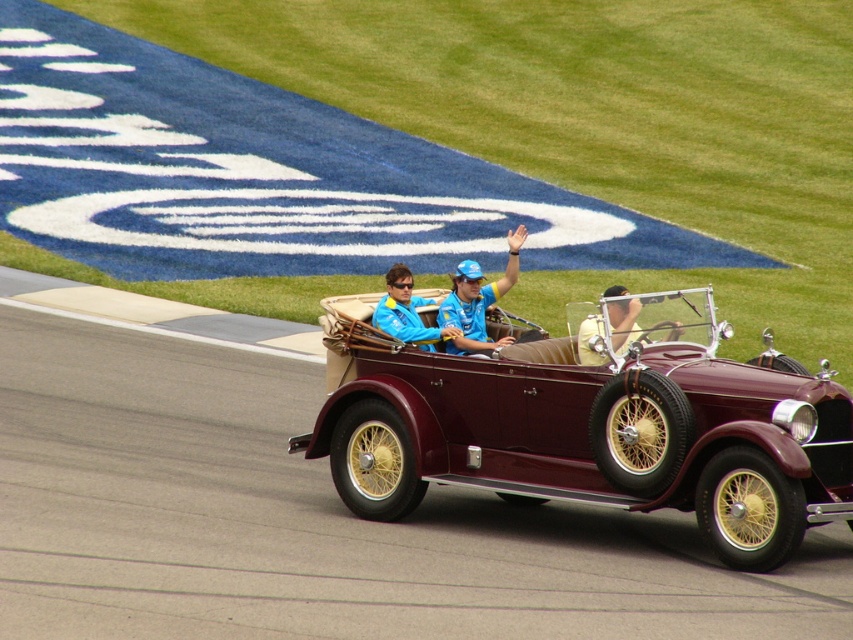
You are a photographer at the event and need to capture a clear photo of the blue fabric shirt at center and the matte blue jacket at center. Which one is closer to the camera?

The blue fabric shirt at center is positioned under the matte blue jacket at center, so the matte blue jacket at center is closer to the camera.

You are a photographer positioned at the starting line of a vintage car race. You want to capture a photo of the vintage maroon convertible car with the two points in the image. The first point is at coordinate point (677, 477) and the second point is at coordinate point (511, 257). Which point should you focus on to ensure the car is in the foreground of your photo?

To ensure the vintage maroon convertible car is in the foreground, focus on point (677, 477) because it is in front of point (511, 257).